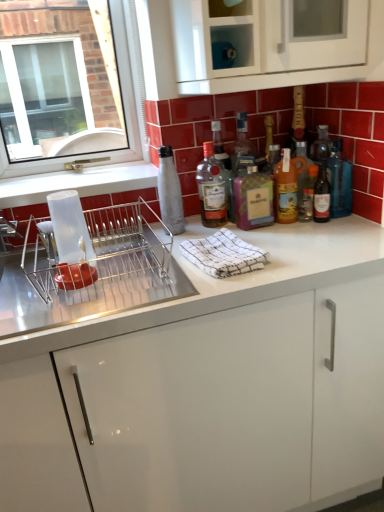
Where is `free space to the right of matte glass wine bottle at center-right`? free space to the right of matte glass wine bottle at center-right is located at coordinates (355, 222).